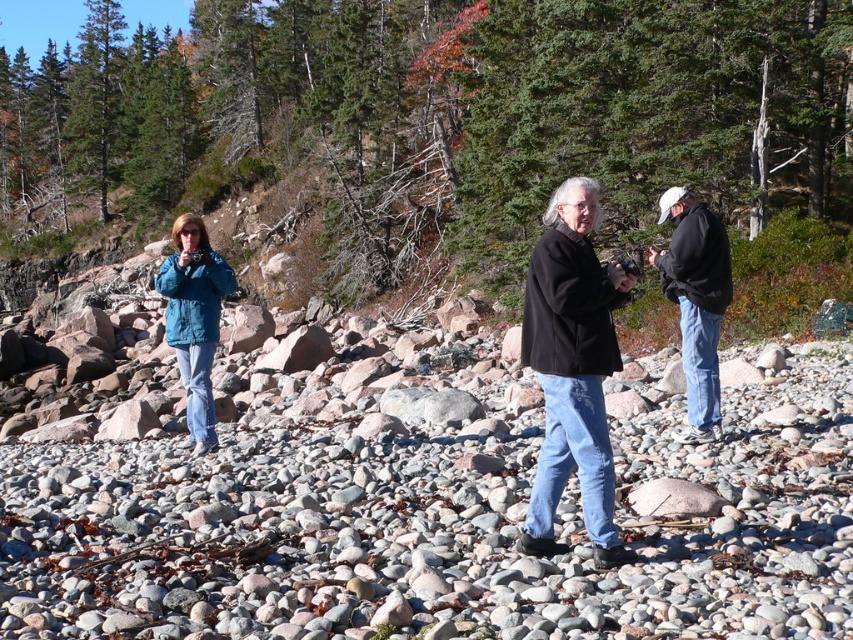
Between black matte jacket at center and teal matte jacket at left, which one appears on the right side from the viewer's perspective?

From the viewer's perspective, black matte jacket at center appears more on the right side.

Is point (619, 264) positioned before point (165, 288)?

Yes, point (619, 264) is in front of point (165, 288).

Where is `black matte jacket at center`? The height and width of the screenshot is (640, 853). black matte jacket at center is located at coordinates (573, 369).

Is black matte jacket at right further to the viewer compared to teal matte jacket at left?

No, black matte jacket at right is closer to the viewer.

Can you confirm if black matte jacket at right is bigger than teal matte jacket at left?

Incorrect, black matte jacket at right is not larger than teal matte jacket at left.

Between point (712, 289) and point (194, 435), which one is positioned behind?

Point (194, 435)

The height and width of the screenshot is (640, 853). I want to click on black matte jacket at right, so click(x=695, y=301).

Consider the image. Is black matte jacket at center bigger than black matte jacket at right?

Yes, black matte jacket at center is bigger than black matte jacket at right.

Which is below, black matte jacket at center or black matte jacket at right?

Positioned lower is black matte jacket at center.

Locate an element on the screen. This screenshot has height=640, width=853. black matte jacket at center is located at coordinates (573, 369).